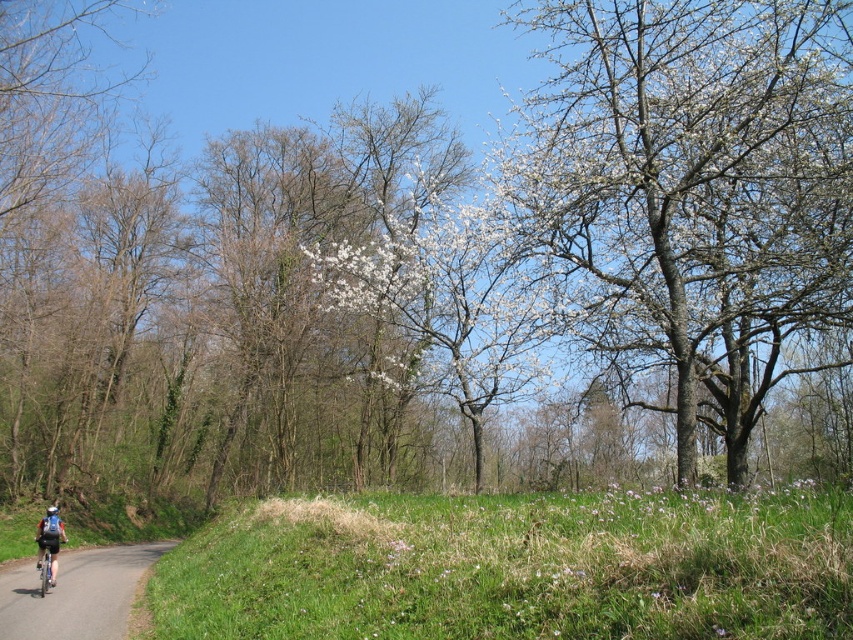
Can you confirm if dark blue fabric backpack at lower left is thinner than blue matte helmet at lower left?

Correct, dark blue fabric backpack at lower left's width is less than blue matte helmet at lower left's.

At what (x,y) coordinates should I click in order to perform the action: click on dark blue fabric backpack at lower left. Please return your answer as a coordinate pair (x, y). This screenshot has height=640, width=853. Looking at the image, I should click on (50, 541).

Describe the element at coordinates (50, 541) in the screenshot. This screenshot has height=640, width=853. I see `dark blue fabric backpack at lower left` at that location.

This screenshot has width=853, height=640. In order to click on dark blue fabric backpack at lower left in this screenshot , I will do `click(50, 541)`.

Which is more to the right, smooth asphalt road at lower left or blue matte helmet at lower left?

smooth asphalt road at lower left is more to the right.

Between point (20, 598) and point (47, 515), which one is positioned in front?

Point (20, 598) is more forward.

The height and width of the screenshot is (640, 853). What are the coordinates of `smooth asphalt road at lower left` in the screenshot? It's located at (76, 593).

Can you confirm if smooth asphalt road at lower left is shorter than dark blue fabric backpack at lower left?

In fact, smooth asphalt road at lower left may be taller than dark blue fabric backpack at lower left.

Is smooth asphalt road at lower left smaller than dark blue fabric backpack at lower left?

Incorrect, smooth asphalt road at lower left is not smaller in size than dark blue fabric backpack at lower left.

Is point (161, 548) farther from camera compared to point (45, 531)?

Yes, it is behind point (45, 531).

Find the location of `smooth asphalt road at lower left`. smooth asphalt road at lower left is located at coordinates (76, 593).